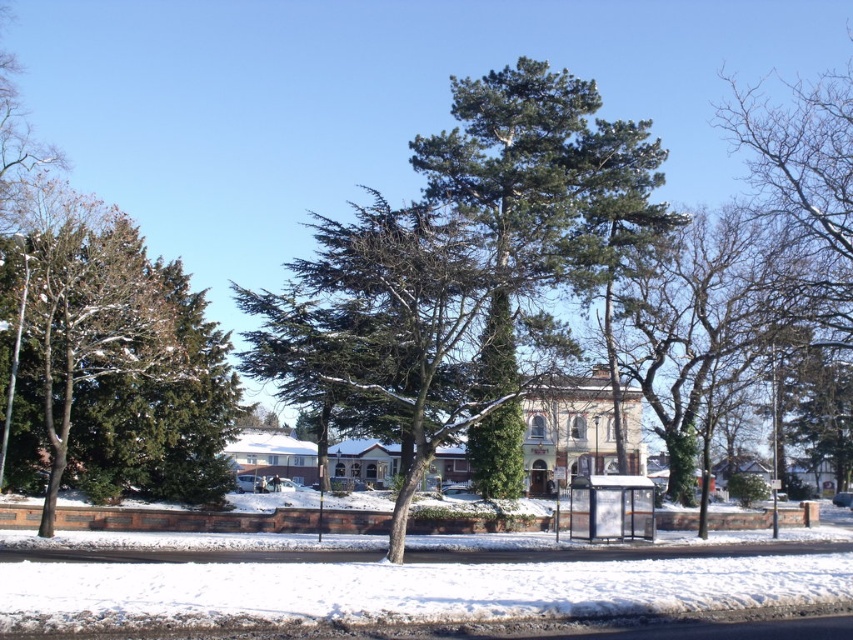
You are a pedestrian standing on the snow covered road and see the green leafy tree at center and the green textured tree at left. Which tree is closer to the road?

The green textured tree at left is closer to the road because it is positioned to the left of the green leafy tree at center, which is further away.

You are standing at the bus stop shelter on the right side of the road. You want to walk to the green leafy tree at center. Which direction should you walk to reach it?

The green leafy tree at center is located at point [695,333], so you should walk towards the center of the image to reach it.